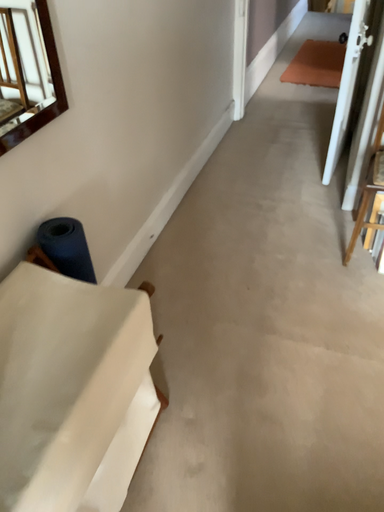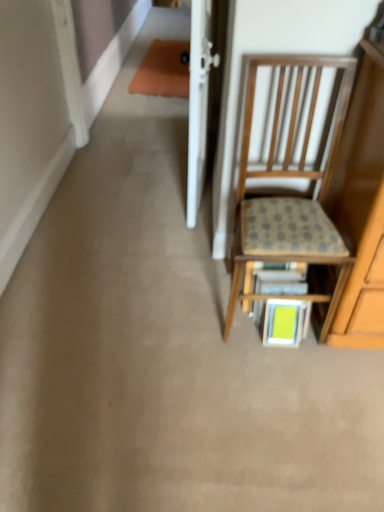
Question: How did the camera likely rotate when shooting the video?

Choices:
 (A) rotated right
 (B) rotated left

Answer: (A)